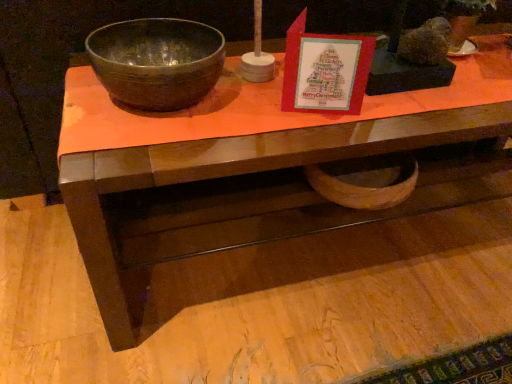
Question: Choose the correct answer: Is wooden desk at center inside matte brown bowl at left or outside it?

Choices:
 (A) inside
 (B) outside

Answer: (B)

Question: Based on their sizes in the image, would you say wooden desk at center is bigger or smaller than matte brown bowl at left?

Choices:
 (A) big
 (B) small

Answer: (A)

Question: Relative to matte brown bowl at left, is wooden desk at center in front or behind?

Choices:
 (A) front
 (B) behind

Answer: (A)

Question: Based on their positions, is matte brown bowl at left located to the left or right of wooden desk at center?

Choices:
 (A) left
 (B) right

Answer: (A)

Question: From the image's perspective, is matte brown bowl at left positioned above or below wooden desk at center?

Choices:
 (A) below
 (B) above

Answer: (B)

Question: In the image, is matte brown bowl at left positioned in front of or behind wooden desk at center?

Choices:
 (A) behind
 (B) front

Answer: (A)

Question: From a real-world perspective, is matte brown bowl at left positioned above or below wooden desk at center?

Choices:
 (A) below
 (B) above

Answer: (B)